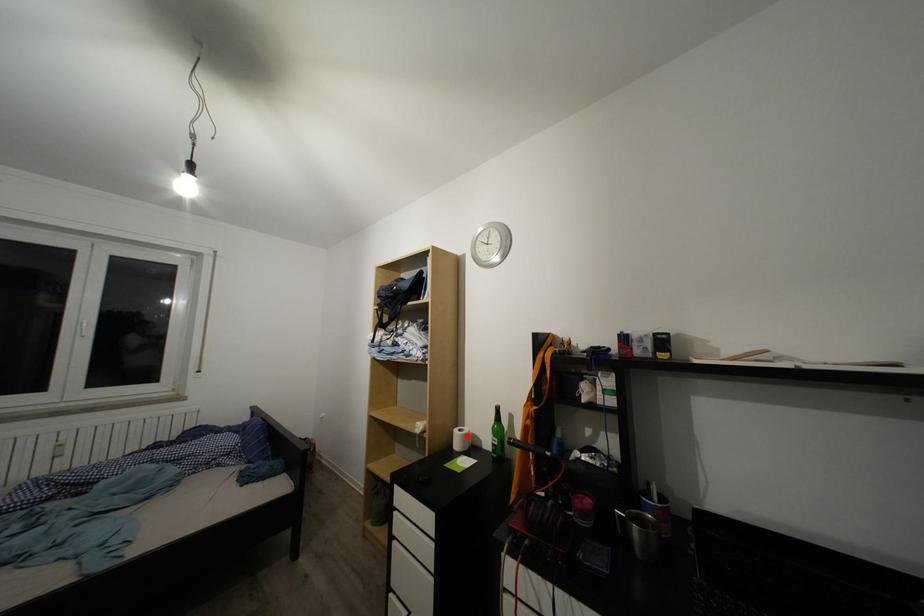
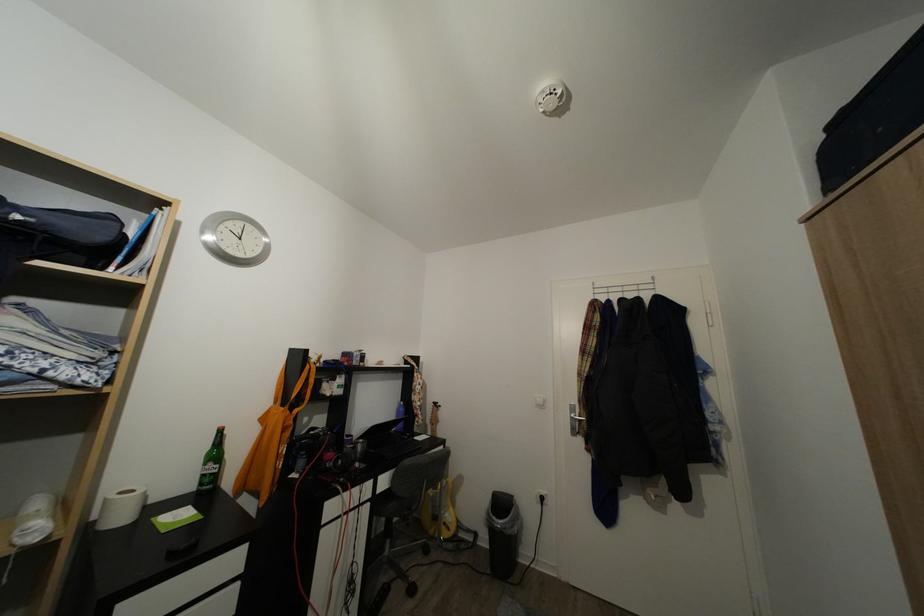
Locate, in the second image, the point that corresponds to the highlighted location in the first image.

(129, 500)